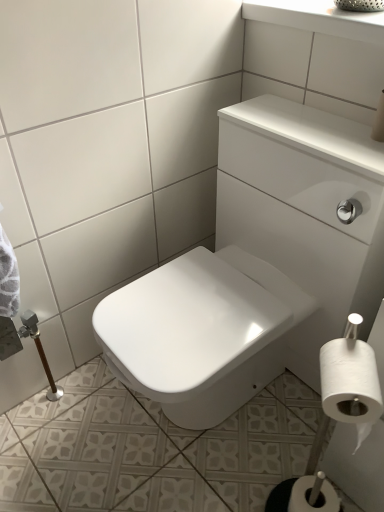
The width and height of the screenshot is (384, 512). What do you see at coordinates (350, 384) in the screenshot?
I see `white matte toilet paper at lower right, which is the second toilet paper in back-to-front order` at bounding box center [350, 384].

What do you see at coordinates (307, 500) in the screenshot?
I see `white matte toilet paper at lower right, positioned as the second toilet paper in front-to-back order` at bounding box center [307, 500].

You are a GUI agent. You are given a task and a screenshot of the screen. Output one action in this format:
    pyautogui.click(x=<x>, y=<y>)
    Task: Click on the white glossy sink at upper center
    The image size is (384, 512).
    Given the screenshot: What is the action you would take?
    pyautogui.click(x=255, y=266)

Is white matte toilet paper at lower right, the 1th toilet paper from the back, beside white matte toilet paper at lower right, which is the second toilet paper in back-to-front order?

They are not placed beside each other.

Which is closer, (326, 488) or (366, 410)?

Positioned in front is point (366, 410).

How much distance is there between white matte toilet paper at lower right, positioned as the second toilet paper in front-to-back order, and white matte toilet paper at lower right, which is the second toilet paper in back-to-front order?

white matte toilet paper at lower right, positioned as the second toilet paper in front-to-back order, is 12.78 inches away from white matte toilet paper at lower right, which is the second toilet paper in back-to-front order.

Is white matte toilet paper at lower right, positioned as the second toilet paper in front-to-back order, in front of white matte toilet paper at lower right, acting as the 2th toilet paper starting from the bottom?

No, white matte toilet paper at lower right, positioned as the second toilet paper in front-to-back order, is further to the viewer.

In terms of width, does white glossy sink at upper center look wider or thinner when compared to white matte toilet paper at lower right, which appears as the first toilet paper when ordered from the bottom?

Clearly, white glossy sink at upper center has more width compared to white matte toilet paper at lower right, which appears as the first toilet paper when ordered from the bottom.

From the image's perspective, which one is positioned lower, white glossy sink at upper center or white matte toilet paper at lower right, which appears as the first toilet paper when ordered from the bottom?

From the image's view, white matte toilet paper at lower right, which appears as the first toilet paper when ordered from the bottom, is below.

Which is in front, point (353, 189) or point (304, 477)?

The point (353, 189) is closer.

Looking at this image, considering the relative positions of white glossy sink at upper center and white matte toilet paper at lower right, which appears as the first toilet paper when ordered from the bottom, in the image provided, is white glossy sink at upper center in front of white matte toilet paper at lower right, which appears as the first toilet paper when ordered from the bottom,?

That is True.

Is point (368, 237) closer to viewer compared to point (341, 421)?

That is False.

Can you tell me how much white glossy sink at upper center and white matte toilet paper at lower right, which is the second toilet paper in back-to-front order, differ in facing direction?

They differ by 52 degrees in their facing directions.

At what (x,y) coordinates should I click in order to perform the action: click on sink lying above the white matte toilet paper at lower right, which ranks as the first toilet paper in front-to-back order (from the image's perspective). Please return your answer as a coordinate pair (x, y). The width and height of the screenshot is (384, 512). Looking at the image, I should click on (255, 266).

From a real-world perspective, is white matte toilet paper at lower right, which ranks as the first toilet paper in front-to-back order, positioned above or below white glossy sink at upper center?

From a real-world perspective, white matte toilet paper at lower right, which ranks as the first toilet paper in front-to-back order, is physically above white glossy sink at upper center.

From the image's perspective, is white matte toilet paper at lower right, which is the second toilet paper in back-to-front order, located above white glossy sink at upper center?

No, from the image's perspective, white matte toilet paper at lower right, which is the second toilet paper in back-to-front order, is not above white glossy sink at upper center.

Which of these two, white matte toilet paper at lower right, acting as the first toilet paper starting from the top, or white glossy sink at upper center, stands taller?

Standing taller between the two is white glossy sink at upper center.

Which toilet paper is the 1st one when counting from the right side of the white glossy sink at upper center? Please provide its 2D coordinates.

[(350, 384)]

Is white matte toilet paper at lower right, which ranks as the first toilet paper in front-to-back order, shorter than white matte toilet paper at lower right, positioned as the second toilet paper in front-to-back order?

In fact, white matte toilet paper at lower right, which ranks as the first toilet paper in front-to-back order, may be taller than white matte toilet paper at lower right, positioned as the second toilet paper in front-to-back order.

Considering the points (351, 379) and (334, 490), which point is in front, point (351, 379) or point (334, 490)?

The point (351, 379) is in front.

Is the position of white matte toilet paper at lower right, acting as the 2th toilet paper starting from the bottom, more distant than that of white matte toilet paper at lower right, which appears as the first toilet paper when ordered from the bottom?

No, it is not.

From the image's perspective, which one is positioned lower, white matte toilet paper at lower right, acting as the 2th toilet paper starting from the bottom, or white matte toilet paper at lower right, arranged as the second toilet paper when viewed from the top?

white matte toilet paper at lower right, arranged as the second toilet paper when viewed from the top, from the image's perspective.

Considering the sizes of objects white matte toilet paper at lower right, which appears as the first toilet paper when ordered from the bottom, and white glossy sink at upper center in the image provided, who is smaller, white matte toilet paper at lower right, which appears as the first toilet paper when ordered from the bottom, or white glossy sink at upper center?

Smaller between the two is white matte toilet paper at lower right, which appears as the first toilet paper when ordered from the bottom.

Is white matte toilet paper at lower right, the 1th toilet paper from the back, to the right of white glossy sink at upper center from the viewer's perspective?

Indeed, white matte toilet paper at lower right, the 1th toilet paper from the back, is positioned on the right side of white glossy sink at upper center.

How much distance is there between white matte toilet paper at lower right, arranged as the second toilet paper when viewed from the top, and white glossy sink at upper center?

white matte toilet paper at lower right, arranged as the second toilet paper when viewed from the top, is 21.40 inches from white glossy sink at upper center.

The image size is (384, 512). Find the location of `toilet paper on the right of the white matte toilet paper at lower right, which is the second toilet paper in back-to-front order`. toilet paper on the right of the white matte toilet paper at lower right, which is the second toilet paper in back-to-front order is located at coordinates (307, 500).

The height and width of the screenshot is (512, 384). Identify the location of sink on the left of white matte toilet paper at lower right, arranged as the second toilet paper when viewed from the top. (255, 266).

From the picture: From the image, which object appears to be nearer to white matte toilet paper at lower right, the 1th toilet paper from the back, white glossy sink at upper center or white matte toilet paper at lower right, acting as the 2th toilet paper starting from the bottom?

Among the two, white matte toilet paper at lower right, acting as the 2th toilet paper starting from the bottom, is located nearer to white matte toilet paper at lower right, the 1th toilet paper from the back.

When comparing their distances from white matte toilet paper at lower right, arranged as the second toilet paper when viewed from the top, does white matte toilet paper at lower right, which is the second toilet paper in back-to-front order, or white glossy sink at upper center seem closer?

white matte toilet paper at lower right, which is the second toilet paper in back-to-front order, lies closer to white matte toilet paper at lower right, arranged as the second toilet paper when viewed from the top, than the other object.

Which object lies nearer to the anchor point white glossy sink at upper center, white matte toilet paper at lower right, acting as the first toilet paper starting from the top, or white matte toilet paper at lower right, arranged as the second toilet paper when viewed from the top?

white matte toilet paper at lower right, acting as the first toilet paper starting from the top, lies closer to white glossy sink at upper center than the other object.

Looking at the image, which one is located further to white glossy sink at upper center, white matte toilet paper at lower right, the 1th toilet paper from the back, or white matte toilet paper at lower right, acting as the first toilet paper starting from the top?

The object further to white glossy sink at upper center is white matte toilet paper at lower right, the 1th toilet paper from the back.

Based on the photo, estimate the real-world distances between objects in this image. Which object is closer to white matte toilet paper at lower right, acting as the first toilet paper starting from the top, white glossy sink at upper center or white matte toilet paper at lower right, positioned as the second toilet paper in front-to-back order?

Among the two, white matte toilet paper at lower right, positioned as the second toilet paper in front-to-back order, is located nearer to white matte toilet paper at lower right, acting as the first toilet paper starting from the top.

Considering their positions, is white matte toilet paper at lower right, the 1th toilet paper from the back, positioned closer to white matte toilet paper at lower right, which is the second toilet paper in back-to-front order, than white glossy sink at upper center?

Based on the image, white matte toilet paper at lower right, the 1th toilet paper from the back, appears to be nearer to white matte toilet paper at lower right, which is the second toilet paper in back-to-front order.

Where is `toilet paper that lies between white glossy sink at upper center and white matte toilet paper at lower right, which appears as the first toilet paper when ordered from the bottom, from top to bottom`? toilet paper that lies between white glossy sink at upper center and white matte toilet paper at lower right, which appears as the first toilet paper when ordered from the bottom, from top to bottom is located at coordinates (350, 384).